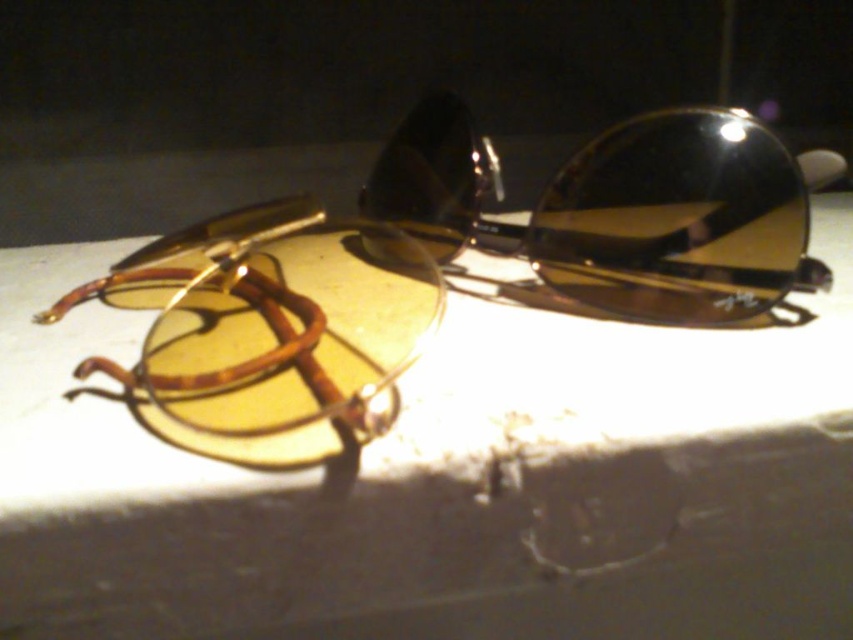
You are trying to determine which item is taller between the shiny black sunglasses at center and the matte brown goggles at left. Based on the scene description, which one is taller?

The shiny black sunglasses at center is much taller as matte brown goggles at left.

You are a photographer setting up a shot of the matte yellow sunglasses at center. The camera is positioned at point A, which is directly to the left of the sunglasses. To ensure the sunglasses are fully visible in the frame, should you adjust the camera to the right or left of point A?

The matte yellow sunglasses at center are positioned at point (447, 481). Since the camera is at point A to the left, adjusting it further to the left would move it away from the sunglasses. Moving the camera to the right of point A would bring it closer, ensuring the sunglasses remain fully visible in the frame.

You are trying to place a small sticker on the reflective surface between the matte yellow sunglasses at center and the matte brown goggles at left. Based on their positions, which object is closer to the sticker if it is placed exactly halfway between them?

The matte yellow sunglasses at center is closer to the viewer than the matte brown goggles at left, so the sticker placed halfway between them would be closer to the matte yellow sunglasses at center.